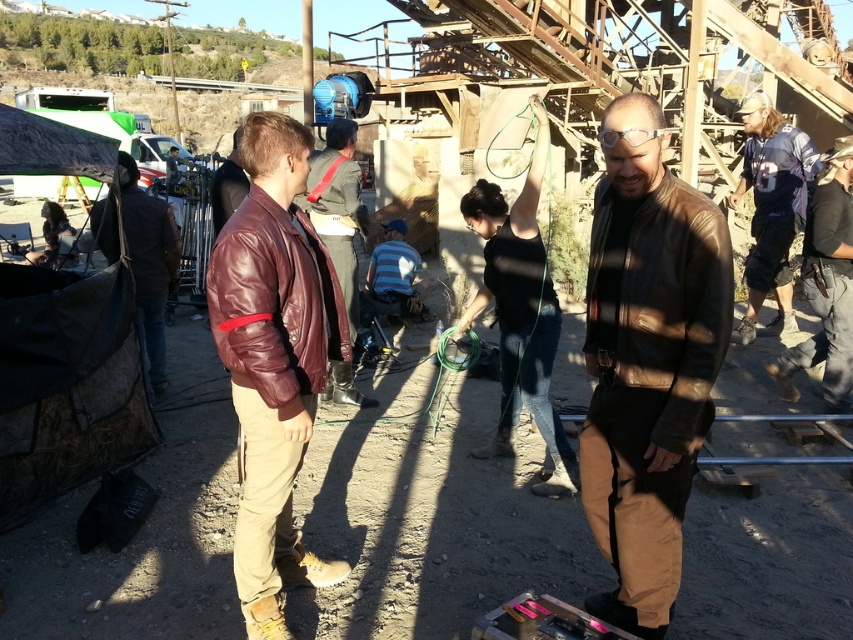
Question: Which object is the farthest from the brown leather jacket at center?

Choices:
 (A) maroon leather jacket at center
 (B) leather jacket at center
 (C) metallic pink tool at center

Answer: (A)

Question: Can you confirm if brown leather jacket at center is bigger than blue jersey at right?

Choices:
 (A) no
 (B) yes

Answer: (A)

Question: Estimate the real-world distances between objects in this image. Which object is farther from the metallic pink tool at center?

Choices:
 (A) leather jacket at center
 (B) maroon leather jacket at center

Answer: (B)

Question: Which object appears farthest from the camera in this image?

Choices:
 (A) metallic pink tool at center
 (B) blue jersey at right
 (C) maroon leather jacket at center

Answer: (B)

Question: Is leather jacket at center to the right of metallic pink tool at center from the viewer's perspective?

Choices:
 (A) yes
 (B) no

Answer: (B)

Question: Does brown leather jacket at center have a larger size compared to metallic pink tool at center?

Choices:
 (A) no
 (B) yes

Answer: (B)